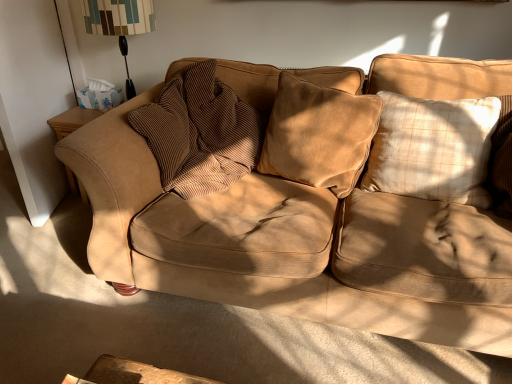
Question: Is beige plaid pillow at right, placed as the third pillow when sorted from left to right, located outside suede couch at center?

Choices:
 (A) yes
 (B) no

Answer: (A)

Question: Is beige plaid pillow at right, placed as the third pillow when sorted from left to right, bigger than suede couch at center?

Choices:
 (A) no
 (B) yes

Answer: (A)

Question: Considering the relative positions of beige plaid pillow at right, placed as the third pillow when sorted from left to right, and suede couch at center in the image provided, is beige plaid pillow at right, placed as the third pillow when sorted from left to right, to the left of suede couch at center from the viewer's perspective?

Choices:
 (A) no
 (B) yes

Answer: (A)

Question: From a real-world perspective, does beige plaid pillow at right, placed as the 1th pillow when sorted from right to left, stand above suede couch at center?

Choices:
 (A) yes
 (B) no

Answer: (A)

Question: Is beige plaid pillow at right, placed as the 1th pillow when sorted from right to left, behind suede couch at center?

Choices:
 (A) no
 (B) yes

Answer: (B)

Question: From the image's perspective, is suede couch at center located above or below patterned fabric lampshade at upper left?

Choices:
 (A) below
 (B) above

Answer: (A)

Question: Looking at their shapes, would you say suede couch at center is wider or thinner than patterned fabric lampshade at upper left?

Choices:
 (A) thin
 (B) wide

Answer: (B)

Question: From their relative heights in the image, would you say suede couch at center is taller or shorter than patterned fabric lampshade at upper left?

Choices:
 (A) tall
 (B) short

Answer: (B)

Question: From a real-world perspective, is suede couch at center above or below patterned fabric lampshade at upper left?

Choices:
 (A) above
 (B) below

Answer: (B)

Question: Based on their sizes in the image, would you say brown corduroy pillow at center, positioned as the third pillow in right-to-left order, is bigger or smaller than velvet brown pillow at center, which is the 2th pillow in right-to-left order?

Choices:
 (A) small
 (B) big

Answer: (B)

Question: Considering the positions of brown corduroy pillow at center, the 1th pillow viewed from the left, and velvet brown pillow at center, arranged as the 2th pillow when viewed from the left, in the image, is brown corduroy pillow at center, the 1th pillow viewed from the left, taller or shorter than velvet brown pillow at center, arranged as the 2th pillow when viewed from the left,?

Choices:
 (A) short
 (B) tall

Answer: (B)

Question: Is brown corduroy pillow at center, the 1th pillow viewed from the left, to the left or to the right of velvet brown pillow at center, which is the 2th pillow in right-to-left order, in the image?

Choices:
 (A) right
 (B) left

Answer: (B)

Question: Is brown corduroy pillow at center, positioned as the third pillow in right-to-left order, situated inside velvet brown pillow at center, which is the 2th pillow in right-to-left order, or outside?

Choices:
 (A) outside
 (B) inside

Answer: (A)

Question: Is beige plaid pillow at right, placed as the 1th pillow when sorted from right to left, inside or outside of patterned fabric lampshade at upper left?

Choices:
 (A) inside
 (B) outside

Answer: (B)

Question: Is point (435, 117) closer or farther from the camera than point (132, 3)?

Choices:
 (A) closer
 (B) farther

Answer: (A)